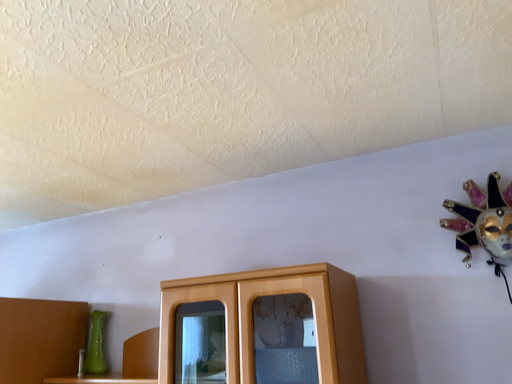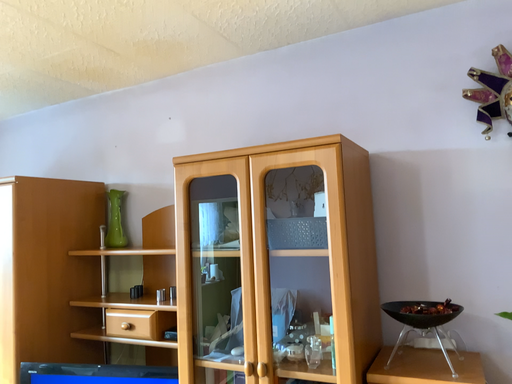
Question: How did the camera likely rotate when shooting the video?

Choices:
 (A) rotated downward
 (B) rotated upward

Answer: (A)